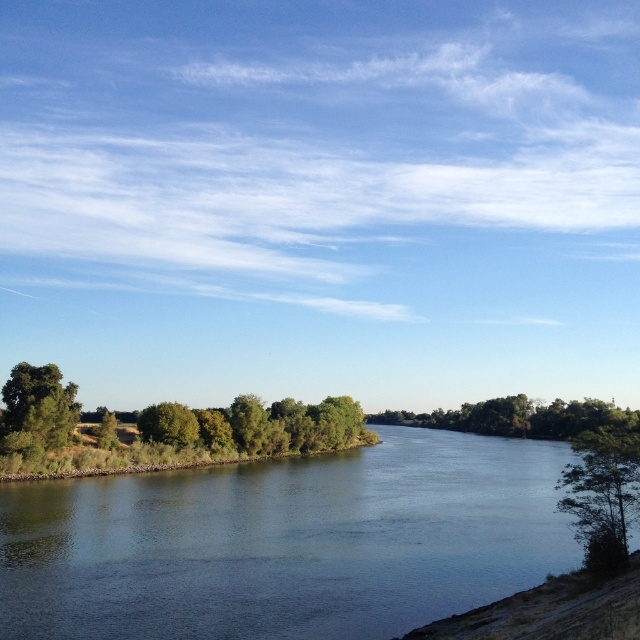
Can you confirm if green leafy tree at lower left is taller than green leafy tree at center?

Indeed, green leafy tree at lower left has a greater height compared to green leafy tree at center.

Is green leafy tree at lower left closer to the viewer compared to green leafy tree at center?

Yes.

The width and height of the screenshot is (640, 640). I want to click on green leafy tree at lower left, so tap(36, 410).

Can you confirm if dark blue water at center is smaller than green leafy tree at center?

No, dark blue water at center is not smaller than green leafy tree at center.

Can you confirm if dark blue water at center is positioned to the left of green leafy tree at center?

No, dark blue water at center is not to the left of green leafy tree at center.

The height and width of the screenshot is (640, 640). Describe the element at coordinates (285, 541) in the screenshot. I see `dark blue water at center` at that location.

You are a GUI agent. You are given a task and a screenshot of the screen. Output one action in this format:
    pyautogui.click(x=<x>, y=<y>)
    Task: Click on the dark blue water at center
    
    Given the screenshot: What is the action you would take?
    pyautogui.click(x=285, y=541)

Is green leafy tree at lower right to the left of green leafy tree at center from the viewer's perspective?

Incorrect, green leafy tree at lower right is not on the left side of green leafy tree at center.

From the picture: Between green leafy tree at lower right and green leafy tree at center, which one appears on the left side from the viewer's perspective?

green leafy tree at center

Which is behind, point (580, 490) or point (172, 404)?

Point (172, 404)

The height and width of the screenshot is (640, 640). In order to click on green leafy tree at lower right in this screenshot , I will do `click(602, 496)`.